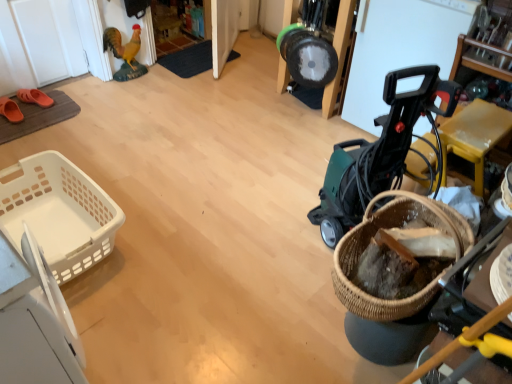
The height and width of the screenshot is (384, 512). Find the location of `vacant area in front of green plastic baby carriage at right`. vacant area in front of green plastic baby carriage at right is located at coordinates (310, 297).